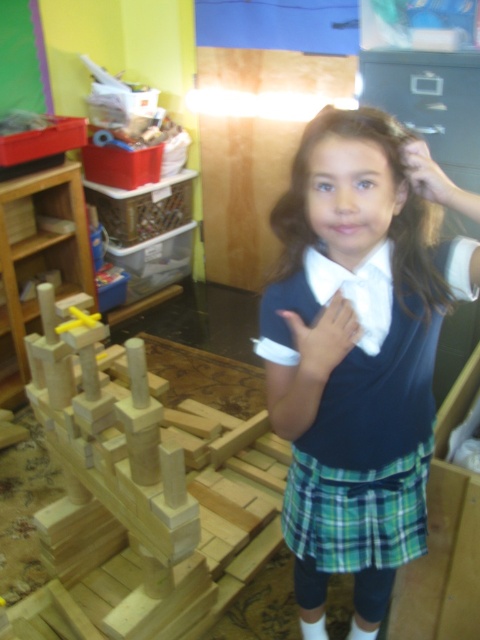
Does matte blue sweater at center appear on the right side of natural wood blocks at left?

Yes, matte blue sweater at center is to the right of natural wood blocks at left.

Identify the location of matte blue sweater at center. (359, 352).

What are the coordinates of `matte blue sweater at center` in the screenshot? It's located at (359, 352).

Is plaid fabric skirt at center closer to camera compared to brown silky hair at center?

That is False.

What do you see at coordinates (357, 513) in the screenshot?
I see `plaid fabric skirt at center` at bounding box center [357, 513].

Is point (336, 513) positioned after point (404, 214)?

Yes, it is behind point (404, 214).

You are a GUI agent. You are given a task and a screenshot of the screen. Output one action in this format:
    pyautogui.click(x=<x>, y=<y>)
    Task: Click on the plaid fabric skirt at center
    Image resolution: width=480 pixels, height=640 pixels.
    Given the screenshot: What is the action you would take?
    pyautogui.click(x=357, y=513)

Describe the element at coordinates (359, 352) in the screenshot. This screenshot has width=480, height=640. I see `matte blue sweater at center` at that location.

Who is more forward, (286, 388) or (320, 493)?

Point (286, 388) is in front.

Is point (328, 150) positioned in front of point (371, 500)?

Yes.

Where is `matte blue sweater at center`? The width and height of the screenshot is (480, 640). matte blue sweater at center is located at coordinates (359, 352).